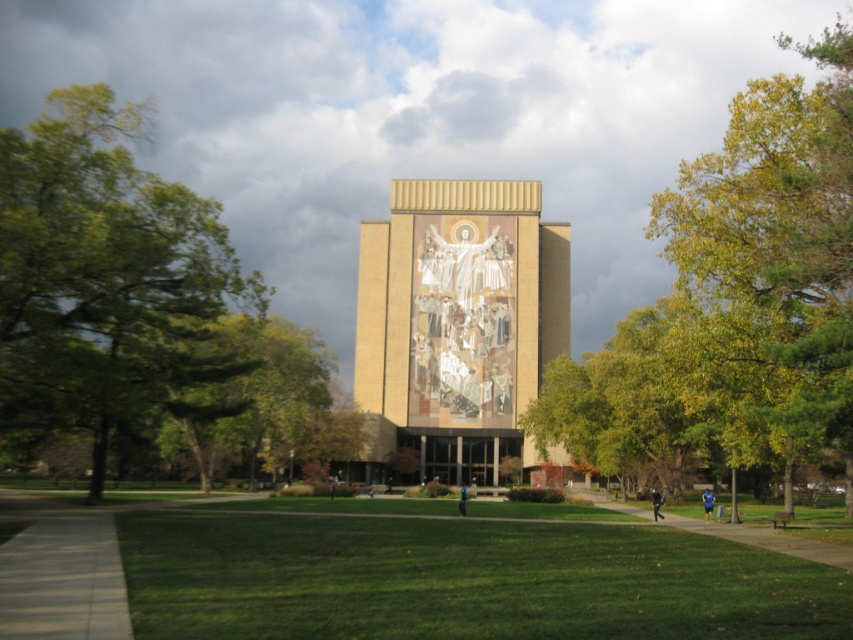
Question: From the image, what is the correct spatial relationship of green leafy tree at left in relation to green leafy tree at center?

Choices:
 (A) below
 (B) above

Answer: (B)

Question: Can you confirm if yellow-green leafy tree at right is positioned below green grass at center?

Choices:
 (A) no
 (B) yes

Answer: (A)

Question: Which point is farther from the camera taking this photo?

Choices:
 (A) (639, 368)
 (B) (189, 257)
 (C) (132, 620)

Answer: (A)

Question: In this image, where is green grass at center located relative to green leafy tree at center?

Choices:
 (A) left
 (B) right

Answer: (B)

Question: Which point is closer to the camera?

Choices:
 (A) (747, 227)
 (B) (300, 369)
 (C) (33, 164)

Answer: (A)

Question: Which object appears closest to the camera in this image?

Choices:
 (A) green grass at center
 (B) green leafy tree at left

Answer: (A)